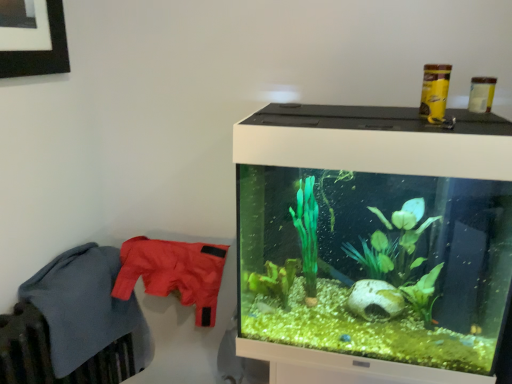
Question: Does transparent glass aquarium at right have a greater height compared to soft fleece blanket at left, the 1th clothing in the left-to-right sequence?

Choices:
 (A) no
 (B) yes

Answer: (A)

Question: Is transparent glass aquarium at right to the right of soft fleece blanket at left, the 1th clothing in the left-to-right sequence, from the viewer's perspective?

Choices:
 (A) yes
 (B) no

Answer: (A)

Question: From a real-world perspective, does transparent glass aquarium at right sit lower than soft fleece blanket at left, the 1th clothing in the left-to-right sequence?

Choices:
 (A) no
 (B) yes

Answer: (A)

Question: From the image's perspective, would you say transparent glass aquarium at right is shown under soft fleece blanket at left, the 1th clothing in the left-to-right sequence?

Choices:
 (A) no
 (B) yes

Answer: (A)

Question: Is transparent glass aquarium at right at the left side of soft fleece blanket at left, the 1th clothing in the left-to-right sequence?

Choices:
 (A) yes
 (B) no

Answer: (B)

Question: Is transparent glass aquarium at right positioned in front of soft fleece blanket at left, positioned as the 2th clothing in right-to-left order?

Choices:
 (A) yes
 (B) no

Answer: (A)

Question: Is soft fleece blanket at left, the 1th clothing in the left-to-right sequence, positioned far away from matte nylon jacket at left, marked as the first clothing in a right-to-left arrangement?

Choices:
 (A) yes
 (B) no

Answer: (B)

Question: From the image's perspective, does soft fleece blanket at left, the 1th clothing in the left-to-right sequence, appear higher than matte nylon jacket at left, arranged as the second clothing when viewed from the left?

Choices:
 (A) no
 (B) yes

Answer: (A)

Question: Is soft fleece blanket at left, the 1th clothing in the left-to-right sequence, oriented away from matte nylon jacket at left, arranged as the second clothing when viewed from the left?

Choices:
 (A) no
 (B) yes

Answer: (A)

Question: Is the position of soft fleece blanket at left, the 1th clothing in the left-to-right sequence, less distant than that of matte nylon jacket at left, marked as the first clothing in a right-to-left arrangement?

Choices:
 (A) no
 (B) yes

Answer: (B)

Question: Considering the relative sizes of soft fleece blanket at left, the 1th clothing in the left-to-right sequence, and matte nylon jacket at left, arranged as the second clothing when viewed from the left, in the image provided, is soft fleece blanket at left, the 1th clothing in the left-to-right sequence, thinner than matte nylon jacket at left, arranged as the second clothing when viewed from the left,?

Choices:
 (A) no
 (B) yes

Answer: (B)

Question: Could you tell me if soft fleece blanket at left, positioned as the 2th clothing in right-to-left order, is facing matte nylon jacket at left, arranged as the second clothing when viewed from the left?

Choices:
 (A) yes
 (B) no

Answer: (A)

Question: From the image's perspective, is matte nylon jacket at left, arranged as the second clothing when viewed from the left, beneath transparent glass aquarium at right?

Choices:
 (A) yes
 (B) no

Answer: (A)